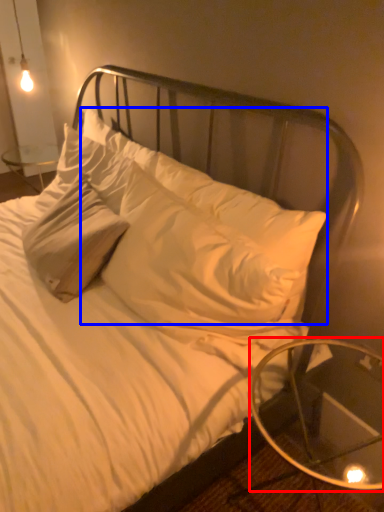
Question: Which point is further to the camera, table (highlighted by a red box) or pillow (highlighted by a blue box)?

Choices:
 (A) table
 (B) pillow

Answer: (B)